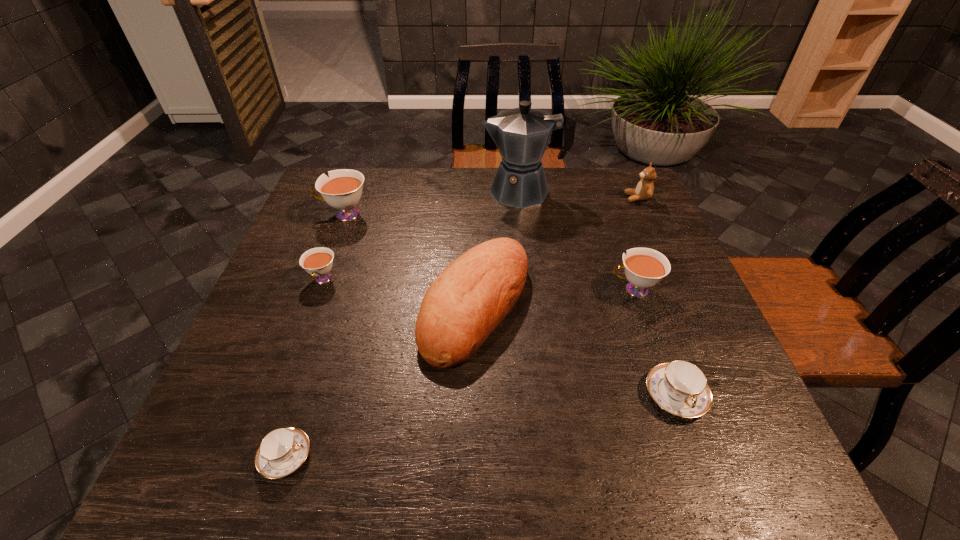
Locate an element on the screen. Image resolution: width=960 pixels, height=540 pixels. the nearer blue teacup is located at coordinates (282, 451).

At what (x,y) coordinates should I click in order to perform the action: click on the nearest object. Please return your answer as a coordinate pair (x, y). This screenshot has height=540, width=960. Looking at the image, I should click on (282, 451).

Image resolution: width=960 pixels, height=540 pixels. Find the location of `free spot located at the spout of the coffeepot`. free spot located at the spout of the coffeepot is located at coordinates (453, 192).

Identify the location of blank space located 0.140m at the spout of the coffeepot. (438, 192).

What are the coordinates of `free point located at the spout of the coffeepot` in the screenshot? It's located at (356, 192).

You are a GUI agent. You are given a task and a screenshot of the screen. Output one action in this format:
    pyautogui.click(x=<x>, y=<y>)
    Task: Click on the vacant space located 0.170m on the front-facing side of the teddy bear
    
    Given the screenshot: What is the action you would take?
    pyautogui.click(x=569, y=198)

Find the location of a particular element. free region located 0.220m on the front-facing side of the teddy bear is located at coordinates (553, 198).

Identify the location of free location located 0.320m on the front-facing side of the teddy bear. (519, 198).

The height and width of the screenshot is (540, 960). Identify the location of free space located 0.230m on the left of the light bread. (322, 306).

Where is `free space located on the side of the rightmost white teacup with the handle`? This screenshot has width=960, height=540. free space located on the side of the rightmost white teacup with the handle is located at coordinates (484, 290).